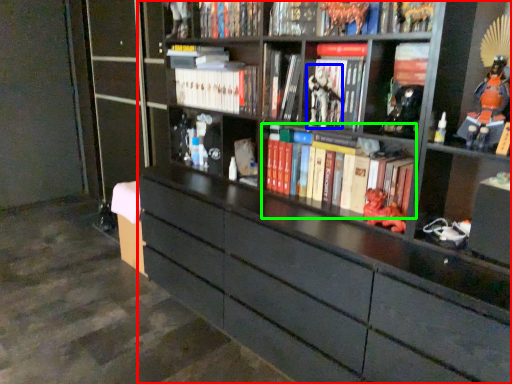
Question: Which is nearer to the bookcase (highlighted by a red box)? comic book character (highlighted by a blue box) or book (highlighted by a green box).

Choices:
 (A) comic book character
 (B) book

Answer: (B)